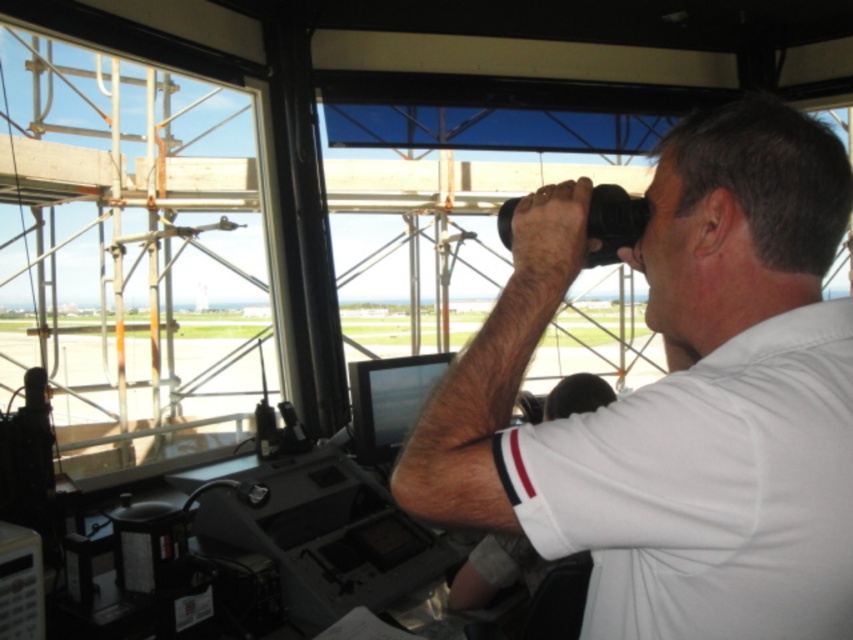
You are standing inside the control tower and want to look outside through the clear glass window at upper left. However, you notice the white matte shirt at upper right is blocking your view. Which object must you move to get an unobstructed view?

You must move the white matte shirt at upper right, as it is positioned to the right of the clear glass window at upper left and is blocking the view.

You are a maintenance worker in the airport control tower. You need to reach the white matte shirt at upper right to retrieve a tool that fell behind it. The tool is 30 inches away from you. Can you safely reach it without moving the shirt?

The white matte shirt at upper right is 29.50 inches from the viewer, which is within the 30 inches distance of the fallen tool. Therefore, you can safely reach the tool without moving the shirt.

You are a maintenance worker in the control tower. You need to clean the white matte shirt at upper right and the clear glass window at upper left. Which object requires more physical effort to reach?

The clear glass window at upper left requires more physical effort to reach because it is larger in size than the white matte shirt at upper right.